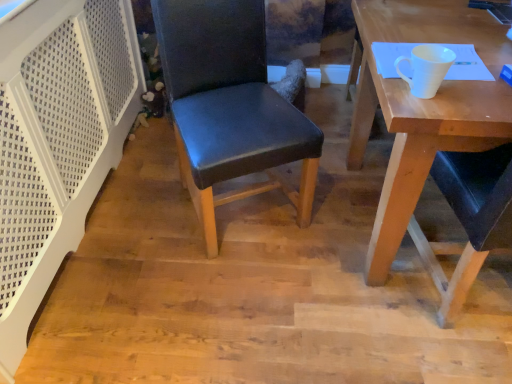
Identify the location of free space between wooden desk at right and black leather chair at center. The image size is (512, 384). (307, 243).